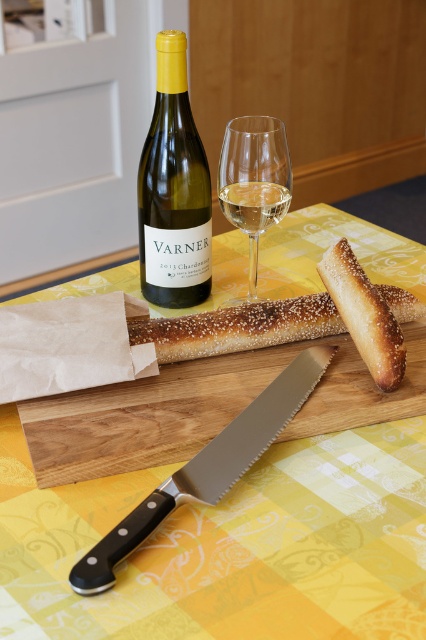
Question: Is serrated silver knife at center to the right of clear glass wine glass at upper center from the viewer's perspective?

Choices:
 (A) yes
 (B) no

Answer: (B)

Question: Which object appears farthest from the camera in this image?

Choices:
 (A) yellow fabric table at center
 (B) sesame seed crust baguette at center

Answer: (B)

Question: Considering the relative positions of wooden cutting board at center and clear glass wine glass at upper center in the image provided, where is wooden cutting board at center located with respect to clear glass wine glass at upper center?

Choices:
 (A) below
 (B) above

Answer: (A)

Question: Which object appears farthest from the camera in this image?

Choices:
 (A) matte yellow glass bottle at upper left
 (B) serrated silver knife at center
 (C) sesame seed-covered bread at center

Answer: (A)

Question: Is wooden cutting board at center below clear glass wine glass at upper center?

Choices:
 (A) yes
 (B) no

Answer: (A)

Question: Which of the following is the closest to the observer?

Choices:
 (A) (400, 428)
 (B) (391, 374)
 (C) (399, 312)
 (D) (262, 426)

Answer: (D)